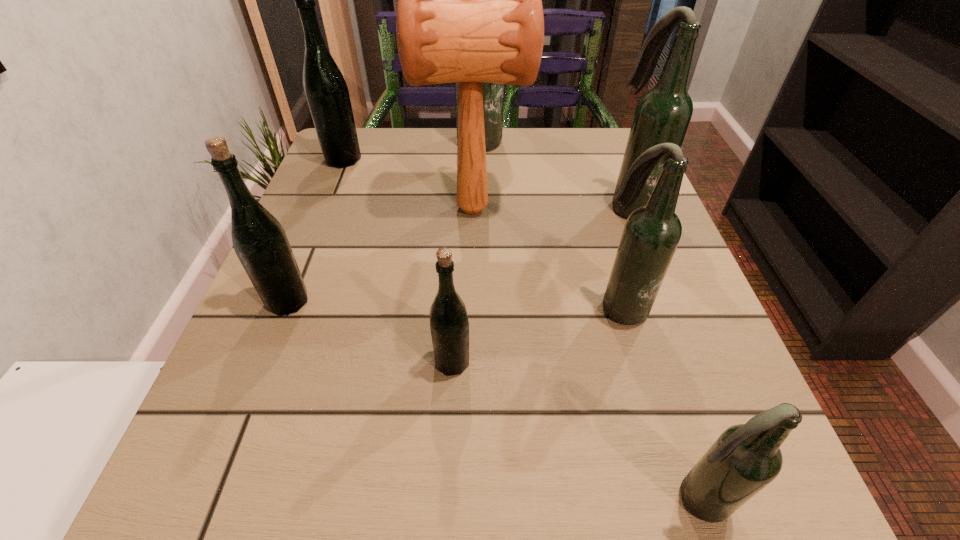
Identify the location of object that ranks as the third closest to the leftmost dark beer bottle. Image resolution: width=960 pixels, height=540 pixels. (663, 113).

Where is `object that is the sixth closest to the second smallest dark beer bottle`? Image resolution: width=960 pixels, height=540 pixels. object that is the sixth closest to the second smallest dark beer bottle is located at coordinates [259, 240].

Identify which beer bottle is located as the third nearest to the third smallest dark beer bottle. Please provide its 2D coordinates. Your answer should be formatted as a tuple, i.e. [(x, y)], where the tuple contains the x and y coordinates of a point satisfying the conditions above.

[(449, 325)]

The height and width of the screenshot is (540, 960). Find the location of `beer bottle that stands as the fourth closest to the farthest dark beer bottle`. beer bottle that stands as the fourth closest to the farthest dark beer bottle is located at coordinates (259, 240).

Identify the location of the third closest dark beer bottle to the biggest green beer bottle. This screenshot has width=960, height=540. (651, 234).

Locate which dark beer bottle ranks third in proximity to the smallest green beer bottle. Please provide its 2D coordinates. Your answer should be formatted as a tuple, i.e. [(x, y)], where the tuple contains the x and y coordinates of a point satisfying the conditions above.

[(663, 113)]

Where is `green beer bottle that is the third closest to the biggest dark beer bottle`? green beer bottle that is the third closest to the biggest dark beer bottle is located at coordinates 449,325.

Identify which green beer bottle is the second closest to the second nearest beer bottle. Please provide its 2D coordinates. Your answer should be formatted as a tuple, i.e. [(x, y)], where the tuple contains the x and y coordinates of a point satisfying the conditions above.

[(326, 91)]

Find the location of a particular element. Image resolution: width=960 pixels, height=540 pixels. vacant region that satisfies the following two spatial constraints: 1. on the back side of the second biggest green beer bottle; 2. on the left side of the farthest dark beer bottle is located at coordinates tap(351, 142).

Identify the location of vacant area in the image that satisfies the following two spatial constraints: 1. on the back side of the second biggest dark beer bottle; 2. on the right side of the second farthest green beer bottle. (326, 206).